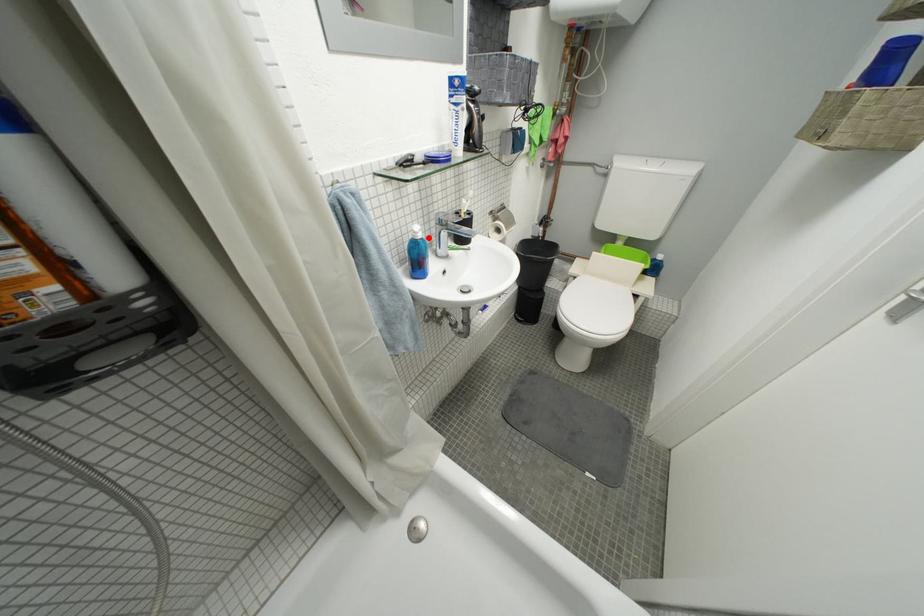
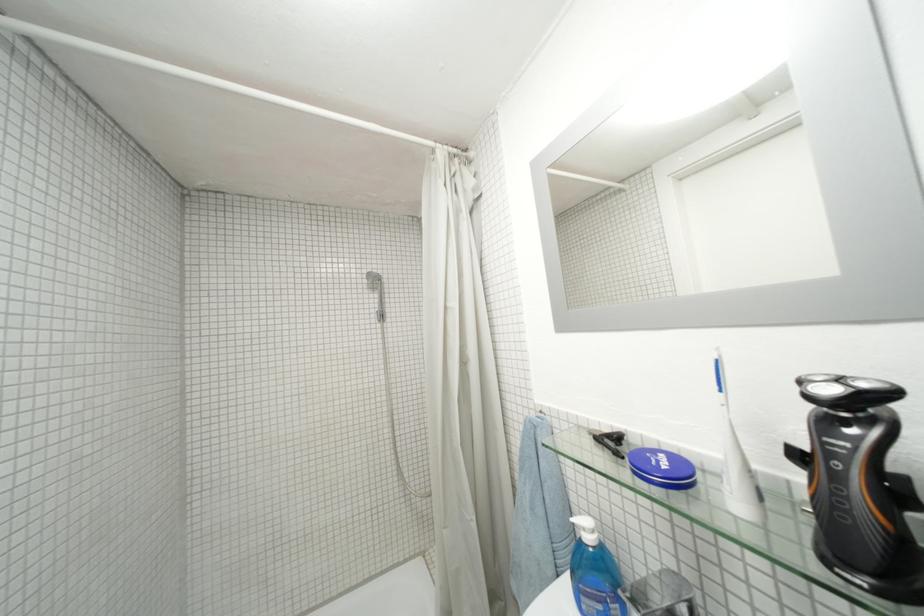
Where in the second image is the point corresponding to the highlighted location from the first image?

(598, 541)